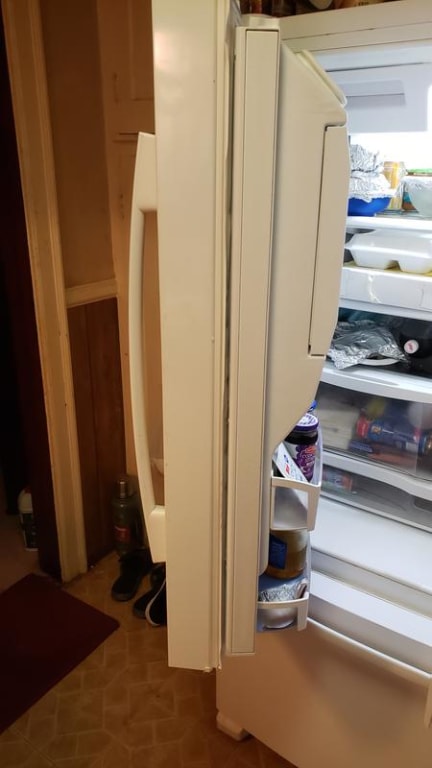
This screenshot has width=432, height=768. Find the location of `aluminum foil on containers in refrigerator`. aluminum foil on containers in refrigerator is located at coordinates (367, 190), (362, 156), (360, 342), (299, 591).